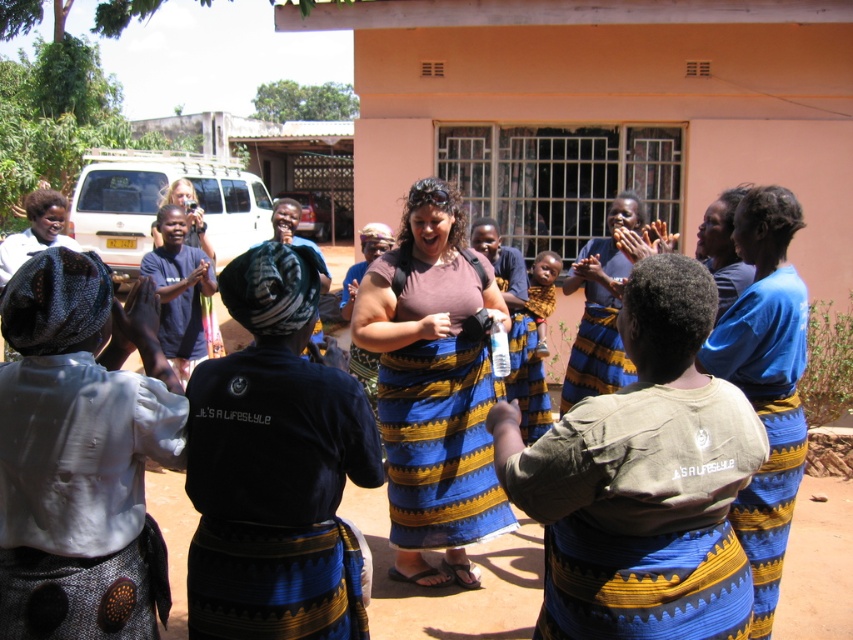
Question: Is matte brown shirt at center below blue striped dress at center?

Choices:
 (A) yes
 (B) no

Answer: (A)

Question: Which of these objects is positioned farthest from the blue striped dress at center?

Choices:
 (A) matte brown shirt at center
 (B) blue woven fabric dress at center

Answer: (B)

Question: Can you confirm if blue woven fabric dress at center is positioned below blue striped skirt at center?

Choices:
 (A) no
 (B) yes

Answer: (A)

Question: Which object is farther from the camera taking this photo?

Choices:
 (A) blue striped dress at center
 (B) matte brown shirt at center
 (C) white cotton shirt at center
 (D) blue woven fabric dress at center

Answer: (A)

Question: Which of the following is the closest to the observer?

Choices:
 (A) (614, 214)
 (B) (450, 404)
 (C) (198, 420)
 (D) (55, 305)

Answer: (D)

Question: Is matte brown shirt at center to the right of blue striped skirt at center from the viewer's perspective?

Choices:
 (A) yes
 (B) no

Answer: (B)